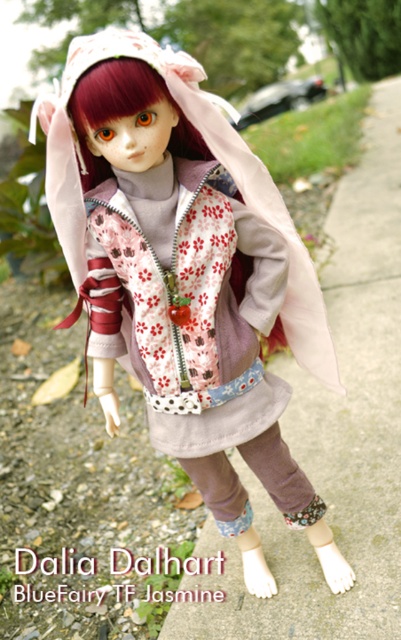
You are a fashion designer observing the doll in the scene. You need to determine which material is easier to cut with a pair of fabric scissors. Which one is easier to cut between the matte pink fabric at center and the gray concrete pavement at center?

The matte pink fabric at center is easier to cut with fabric scissors since it is thinner than the gray concrete pavement at center.

You are a delivery robot that needs to place a package on the ground. You see the matte pink fabric at center and the gray concrete pavement at center. Which surface should you choose to place the package?

The gray concrete pavement at center is the appropriate surface to place the package because the matte pink fabric at center is positioned under it and likely not accessible for placement.